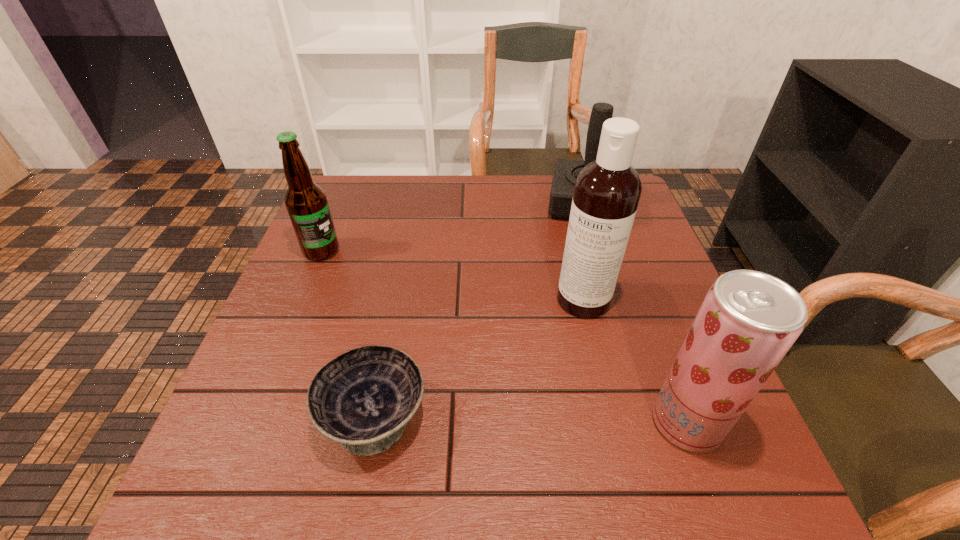
I want to click on vacant space at the left edge of the desktop, so click(x=355, y=231).

Identify the location of vacant space at the right edge. The image size is (960, 540). (648, 281).

Locate an element on the screen. Image resolution: width=960 pixels, height=540 pixels. vacant space at the far left corner is located at coordinates (368, 208).

Find the location of a particular element. This screenshot has width=960, height=540. vacant space that is in between the tallest object and the fourth object from right to left is located at coordinates (479, 359).

Where is `blank region between the dishwasher detergent and the fruit juice`? The image size is (960, 540). blank region between the dishwasher detergent and the fruit juice is located at coordinates (635, 361).

Where is `vacant space that's between the shortest object and the farthest object`? Image resolution: width=960 pixels, height=540 pixels. vacant space that's between the shortest object and the farthest object is located at coordinates (480, 310).

I want to click on free space between the third farthest object and the fruit juice, so click(635, 361).

Locate an element on the screen. vacant space that's between the fruit juice and the shortest object is located at coordinates (531, 419).

At what (x,y) coordinates should I click in order to perform the action: click on empty space that is in between the fruit juice and the second object from left to right. Please return your answer as a coordinate pair (x, y). The image size is (960, 540). Looking at the image, I should click on (531, 419).

Image resolution: width=960 pixels, height=540 pixels. Identify the location of free spot between the third farthest object and the second object from left to right. (479, 359).